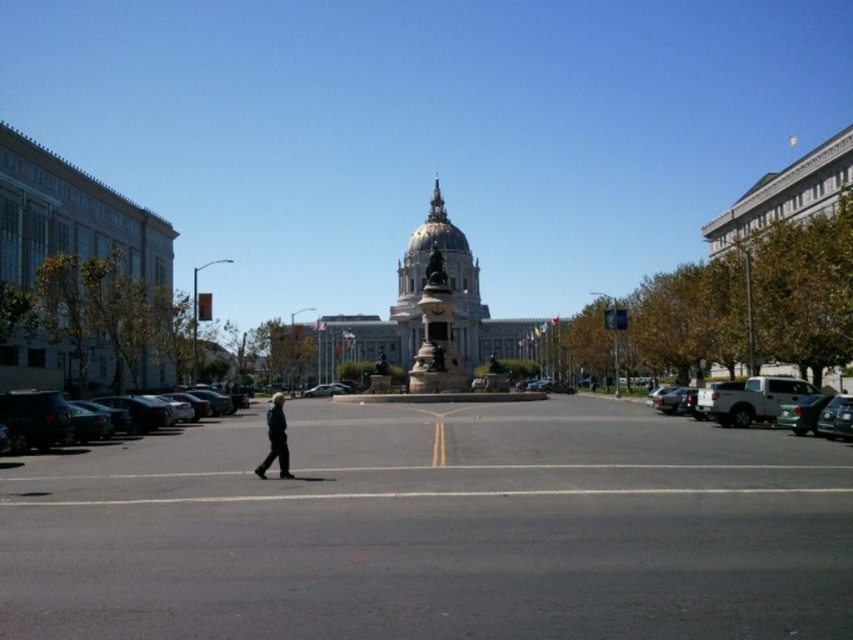
Can you confirm if dark blue jacket at center is bigger than metallic silver sedan at center?

Correct, dark blue jacket at center is larger in size than metallic silver sedan at center.

Which is in front, point (276, 436) or point (318, 387)?

Point (276, 436) is in front.

Image resolution: width=853 pixels, height=640 pixels. Identify the location of dark blue jacket at center. (276, 438).

Between dark green matte car at left and gold textured spire at center, which one is positioned lower?

dark green matte car at left

Does dark green matte car at left appear over gold textured spire at center?

No.

The height and width of the screenshot is (640, 853). I want to click on dark green matte car at left, so coord(65,419).

Is dark green matte car at left further to the viewer compared to metallic silver sedan at center?

No.

What do you see at coordinates (65, 419) in the screenshot? I see `dark green matte car at left` at bounding box center [65, 419].

Does point (16, 452) come closer to viewer compared to point (335, 392)?

Yes.

Where is `dark green matte car at left`? This screenshot has height=640, width=853. dark green matte car at left is located at coordinates (65, 419).